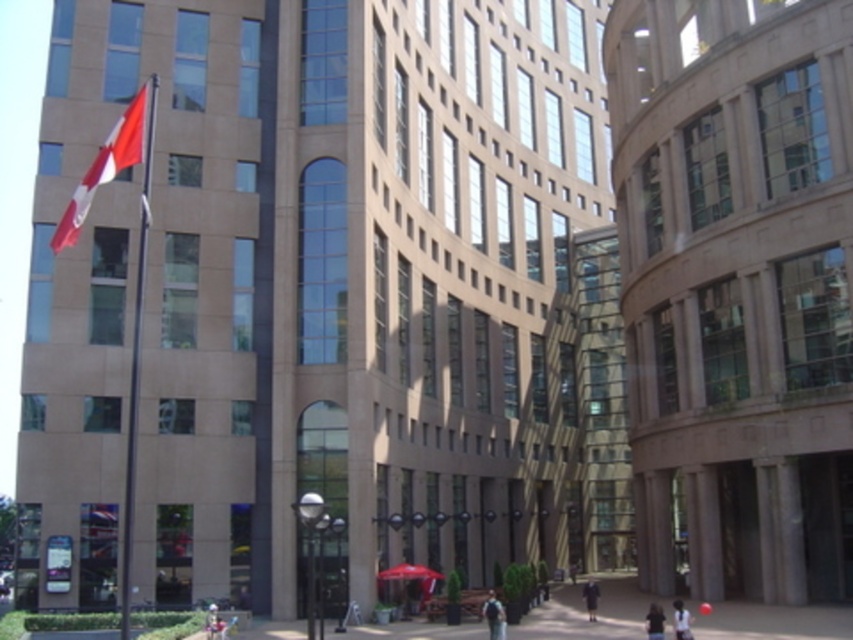
Question: Among these points, which one is nearest to the camera?

Choices:
 (A) (659, 611)
 (B) (144, 115)
 (C) (676, 604)

Answer: (B)

Question: Observing the image, what is the correct spatial positioning of white fabric shirt at lower right in reference to blurred fabric person at lower right?

Choices:
 (A) above
 (B) below

Answer: (A)

Question: Based on their relative distances, which object is nearer to the blurred fabric person at lower right?

Choices:
 (A) red fabric flag at upper left
 (B) dark blue backpack at center

Answer: (B)

Question: Is dark blue backpack at center bigger than blurred fabric person at lower right?

Choices:
 (A) no
 (B) yes

Answer: (A)

Question: Which of the following is the farthest from the observer?

Choices:
 (A) (80, 189)
 (B) (688, 628)

Answer: (A)

Question: Is red fabric flag at upper left to the right of dark gray coat at center from the viewer's perspective?

Choices:
 (A) no
 (B) yes

Answer: (A)